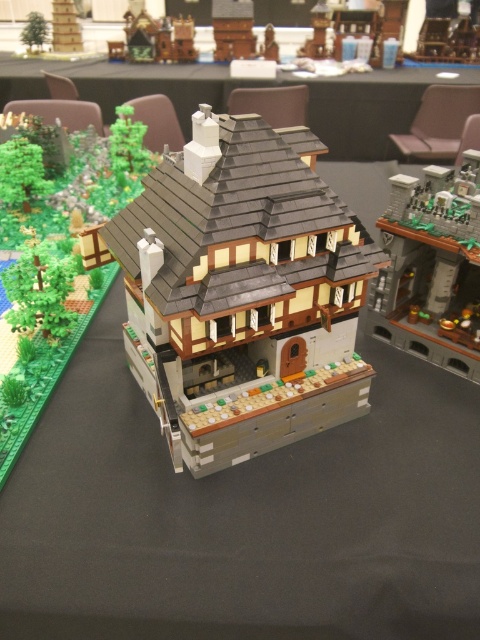
Between point (139, 346) and point (165, 86), which one is positioned behind?

Point (165, 86)

What do you see at coordinates (242, 292) in the screenshot? The width and height of the screenshot is (480, 640). I see `brick-like brown house at center` at bounding box center [242, 292].

The width and height of the screenshot is (480, 640). I want to click on brick-like brown house at center, so click(242, 292).